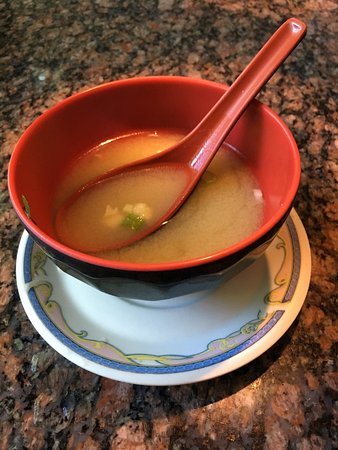
Where is `bowl`? The height and width of the screenshot is (450, 338). bowl is located at coordinates [281, 196].